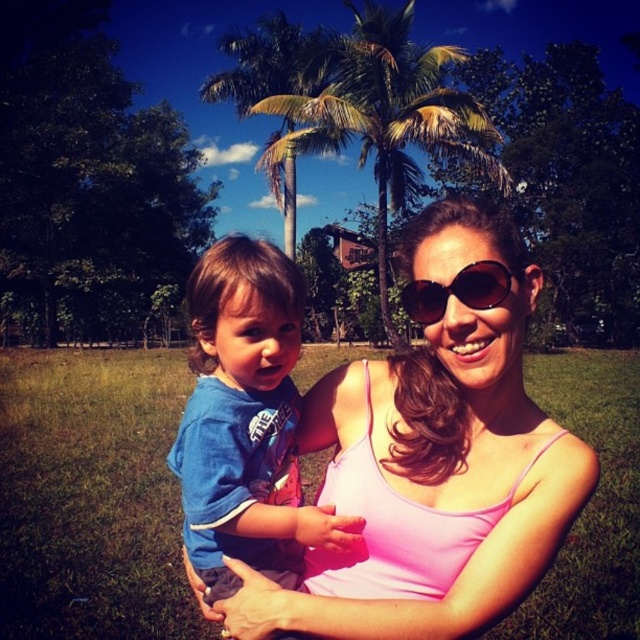
In order to click on green grass at center in this screenshot , I will do `click(92, 497)`.

Which is in front, point (170, 636) or point (397, 196)?

Positioned in front is point (170, 636).

At what (x,y) coordinates should I click in order to perform the action: click on green grass at center. Please return your answer as a coordinate pair (x, y). The width and height of the screenshot is (640, 640). Looking at the image, I should click on (92, 497).

Which is above, blue cotton shirt at center or green leafy palm tree at center?

green leafy palm tree at center

Between blue cotton shirt at center and green leafy palm tree at center, which one is positioned lower?

blue cotton shirt at center

Which is in front, point (232, 406) or point (444, 132)?

Point (232, 406) is in front.

At what (x,y) coordinates should I click in order to perform the action: click on blue cotton shirt at center. Please return your answer as a coordinate pair (x, y). The image size is (640, 640). Looking at the image, I should click on (246, 422).

Is green grass at center bigger than blue cotton shirt at center?

Correct, green grass at center is larger in size than blue cotton shirt at center.

Which is more to the right, green grass at center or blue cotton shirt at center?

Positioned to the right is blue cotton shirt at center.

Between point (156, 611) and point (200, 346), which one is positioned in front?

Point (200, 346)

Locate an element on the screen. This screenshot has height=640, width=640. green grass at center is located at coordinates (92, 497).